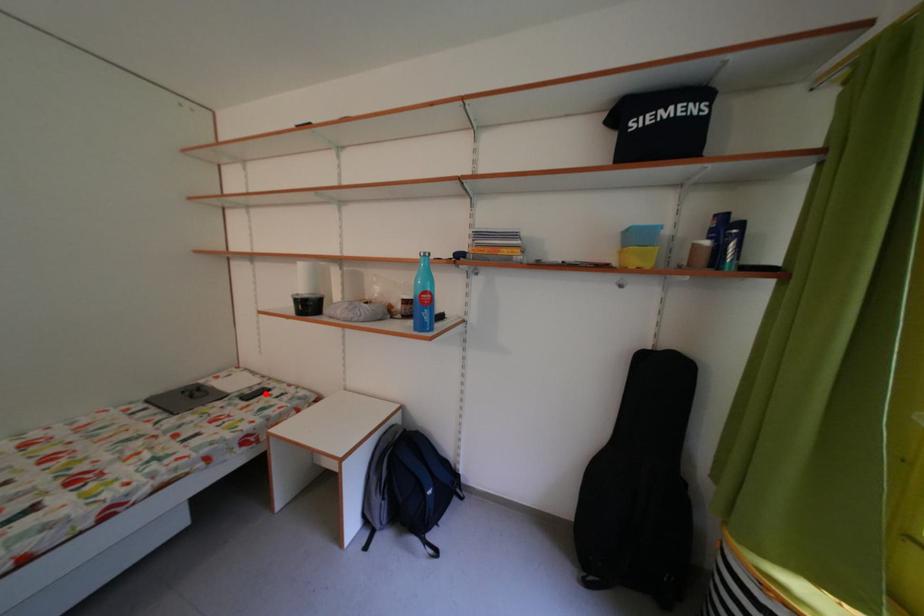
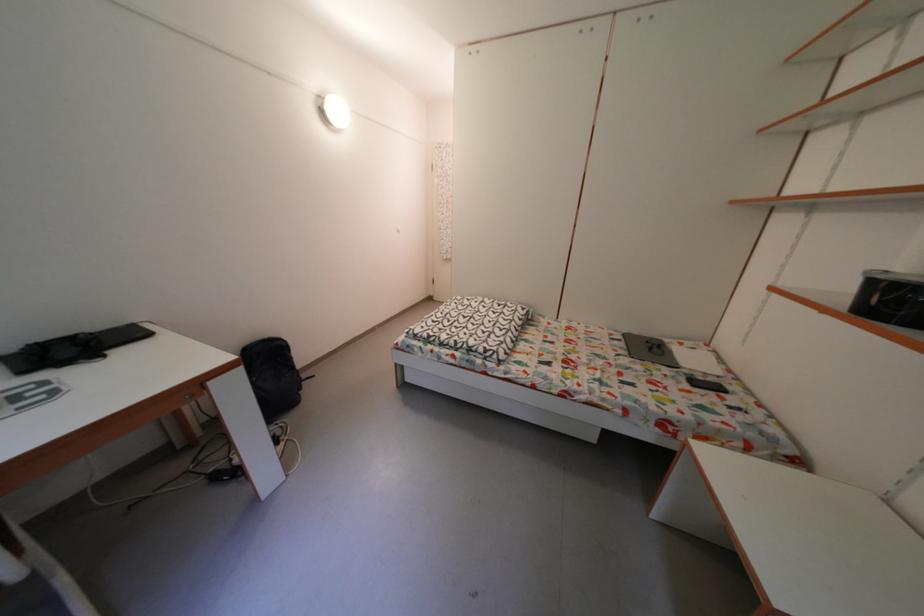
Locate, in the second image, the point that corresponds to the highlighted location in the first image.

(721, 385)